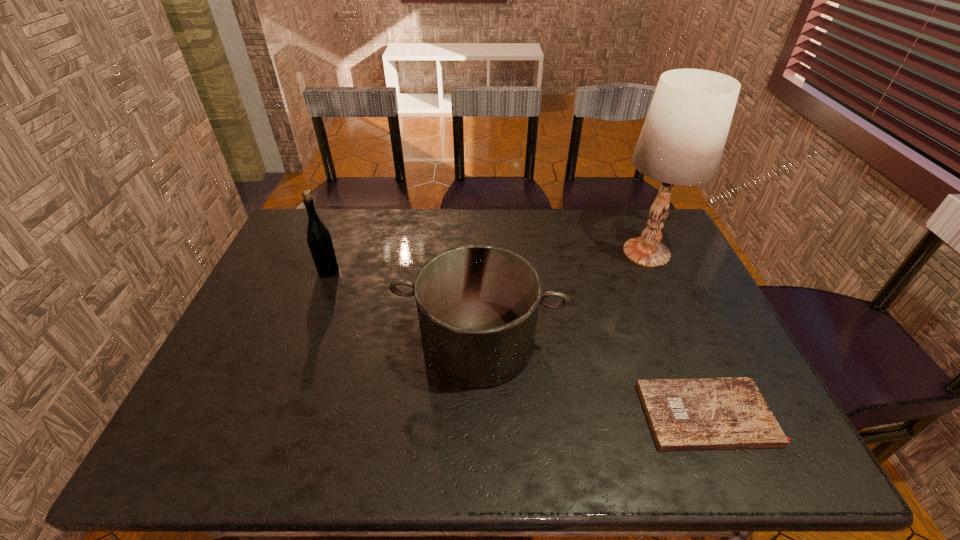
Locate an element on the screen. The width and height of the screenshot is (960, 540). object at the far edge is located at coordinates (682, 140).

Find the location of `object that is at the near edge`. object that is at the near edge is located at coordinates (699, 413).

Find the location of `object located in the left edge section of the desktop`. object located in the left edge section of the desktop is located at coordinates pyautogui.click(x=319, y=239).

You are a GUI agent. You are given a task and a screenshot of the screen. Output one action in this format:
    pyautogui.click(x=<x>, y=<y>)
    Task: Click on the lamp positioned at the right edge
    The image size is (960, 540).
    Given the screenshot: What is the action you would take?
    pyautogui.click(x=682, y=140)

Locate an element on the screen. Bible that is at the right edge is located at coordinates (699, 413).

The height and width of the screenshot is (540, 960). Find the location of `object that is positioned at the far right corner`. object that is positioned at the far right corner is located at coordinates (682, 140).

The image size is (960, 540). Identify the location of object positioned at the near right corner. (699, 413).

In the image, there is a desktop. Identify the location of free space at the far edge. (355, 219).

You are a GUI agent. You are given a task and a screenshot of the screen. Output one action in this format:
    pyautogui.click(x=<x>, y=<y>)
    Task: Click on the vacant area at the left edge
    The height and width of the screenshot is (540, 960).
    Given the screenshot: What is the action you would take?
    pyautogui.click(x=231, y=334)

At what (x,y) coordinates should I click in order to perform the action: click on free space at the right edge of the desktop. Please return your answer as a coordinate pair (x, y). Image resolution: width=960 pixels, height=540 pixels. Looking at the image, I should click on (682, 288).